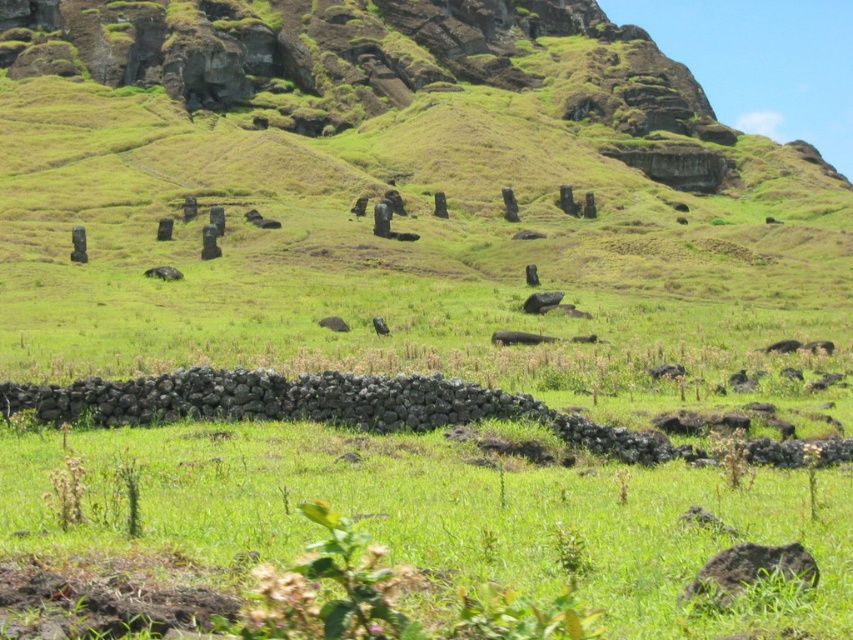
You are a hiker who has stumbled upon this ancient statue site. You notice two animals, a black fur animal at center and a black matte animal at center, near the statues. Which animal is closer to the ground?

The black fur animal at center is positioned under the black matte animal at center, so the black fur animal at center is closer to the ground.

You are a visitor standing at the edge of the grassy hillside and see both the black stone moai at center and the black matte animal at center. Which object is closer to you?

The black stone moai at center is closer to you since the black matte animal at center is positioned behind it.

You are a hiker who wants to place a small marker exactly at the center of the image. You see a black fur animal at center. Is the animal located exactly at the center of the image?

The black fur animal at center is located at point (519, 337), which is very close to the center but not exactly at the center of the image.